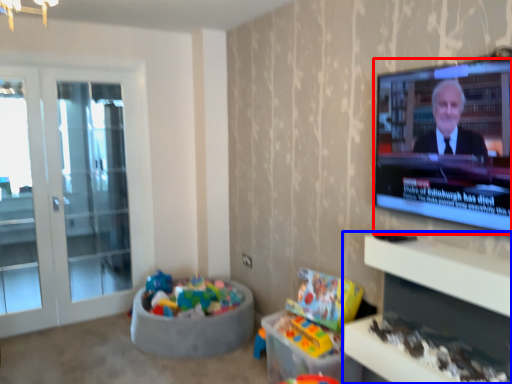
Question: Which object appears closest to the camera in this image, television (highlighted by a red box) or entertainment center (highlighted by a blue box)?

Choices:
 (A) television
 (B) entertainment center

Answer: (B)